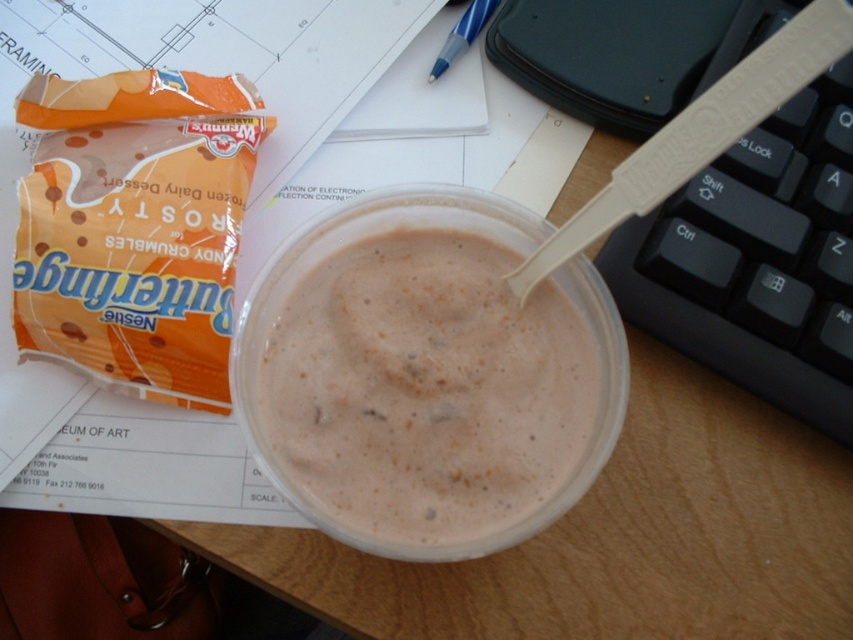
In the scene shown: Measure the distance between point (461, 196) and camera.

13.36 inches

The width and height of the screenshot is (853, 640). Describe the element at coordinates (427, 376) in the screenshot. I see `white creamy pudding at center` at that location.

Locate an element on the screen. white creamy pudding at center is located at coordinates (427, 376).